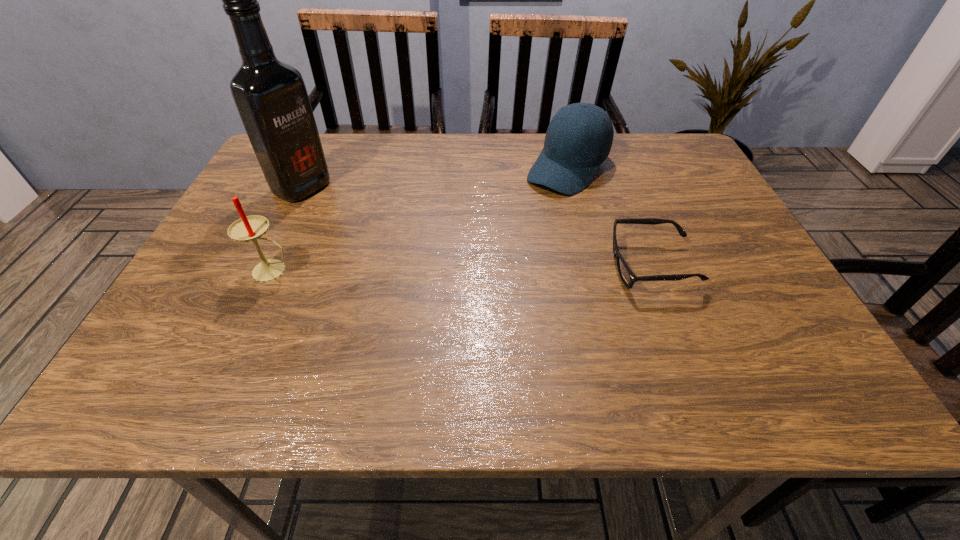
Where is `vacant space that's between the shortest object and the tallest object`? vacant space that's between the shortest object and the tallest object is located at coordinates (477, 226).

Locate an element on the screen. The width and height of the screenshot is (960, 540). unoccupied position between the liquor and the baseball cap is located at coordinates (435, 178).

The width and height of the screenshot is (960, 540). Identify the location of free point between the candle and the baseball cap. (420, 219).

This screenshot has width=960, height=540. Identify the location of free space between the third tallest object and the sunglasses. (610, 217).

You are a GUI agent. You are given a task and a screenshot of the screen. Output one action in this format:
    pyautogui.click(x=<x>, y=<y>)
    Task: Click on the free space between the second shortest object and the liquor
    
    Given the screenshot: What is the action you would take?
    pyautogui.click(x=435, y=178)

Locate which object is the third closest to the candle. Please provide its 2D coordinates. Your answer should be formatted as a tuple, i.e. [(x, y)], where the tuple contains the x and y coordinates of a point satisfying the conditions above.

[(627, 276)]

This screenshot has width=960, height=540. Identify the location of object that is the third closest to the second tallest object. (627, 276).

Find the location of a particular element. The width and height of the screenshot is (960, 540). vacant space that satisfies the following two spatial constraints: 1. on the back side of the candle; 2. on the front-facing side of the shortest object is located at coordinates (276, 266).

Find the location of a particular element. free space that satisfies the following two spatial constraints: 1. on the back side of the candle; 2. on the left side of the baseball cap is located at coordinates coord(320,168).

This screenshot has height=540, width=960. Find the location of `free space in the image that satisfies the following two spatial constraints: 1. on the front side of the tallest object; 2. on the front-facing side of the shortest object`. free space in the image that satisfies the following two spatial constraints: 1. on the front side of the tallest object; 2. on the front-facing side of the shortest object is located at coordinates (263, 266).